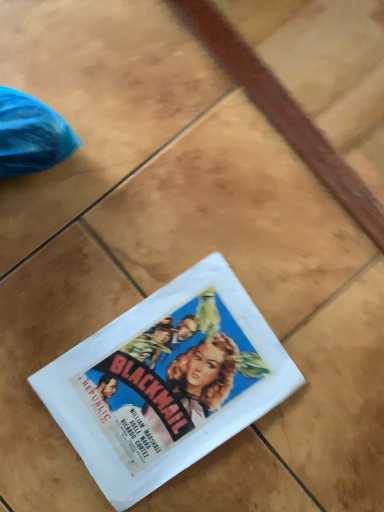
What are the coordinates of `free space above white paper flyer at center (from a real-world perspective)` in the screenshot? It's located at (167, 385).